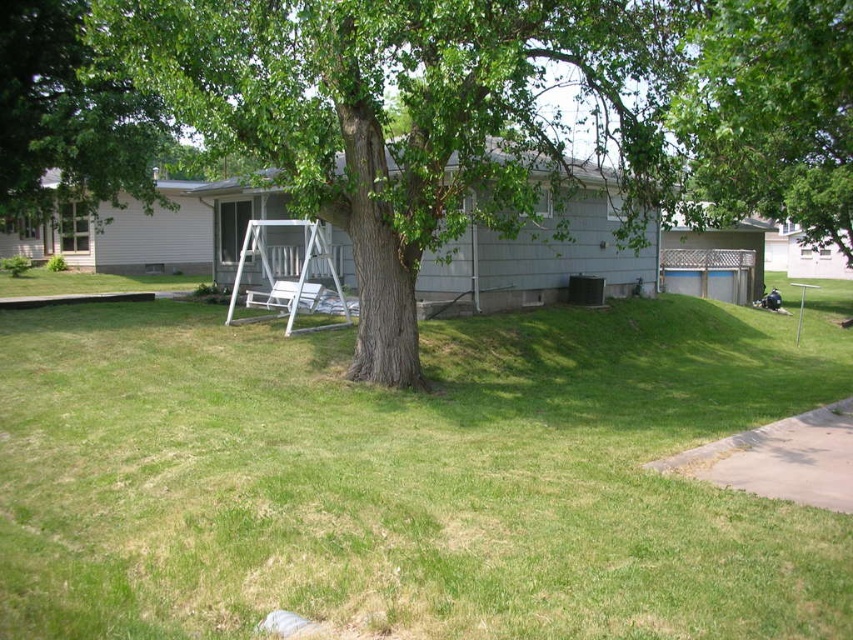
Question: Which point is farther to the camera?

Choices:
 (A) (300, 528)
 (B) (701, 3)

Answer: (B)

Question: Which of these objects is positioned farthest from the green grass at center?

Choices:
 (A) green leafy tree at upper left
 (B) green rough bark tree at center
 (C) white plastic chair at center

Answer: (A)

Question: Can you confirm if green rough bark tree at center is wider than green leafy tree at upper center?

Choices:
 (A) yes
 (B) no

Answer: (B)

Question: In this image, where is white wooden swing at center located relative to white plastic chair at center?

Choices:
 (A) right
 (B) left

Answer: (A)

Question: Which of the following is the farthest from the observer?

Choices:
 (A) (254, 292)
 (B) (834, 184)
 (C) (270, 64)

Answer: (B)

Question: Is green leafy tree at upper center to the left of green leafy tree at upper left from the viewer's perspective?

Choices:
 (A) yes
 (B) no

Answer: (B)